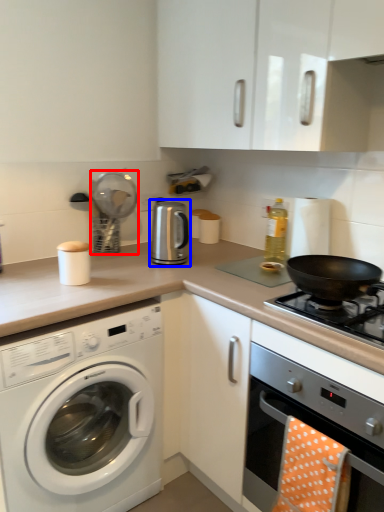
Question: Which point is closer to the camera, appliance (highlighted by a red box) or appliance (highlighted by a blue box)?

Choices:
 (A) appliance
 (B) appliance

Answer: (B)